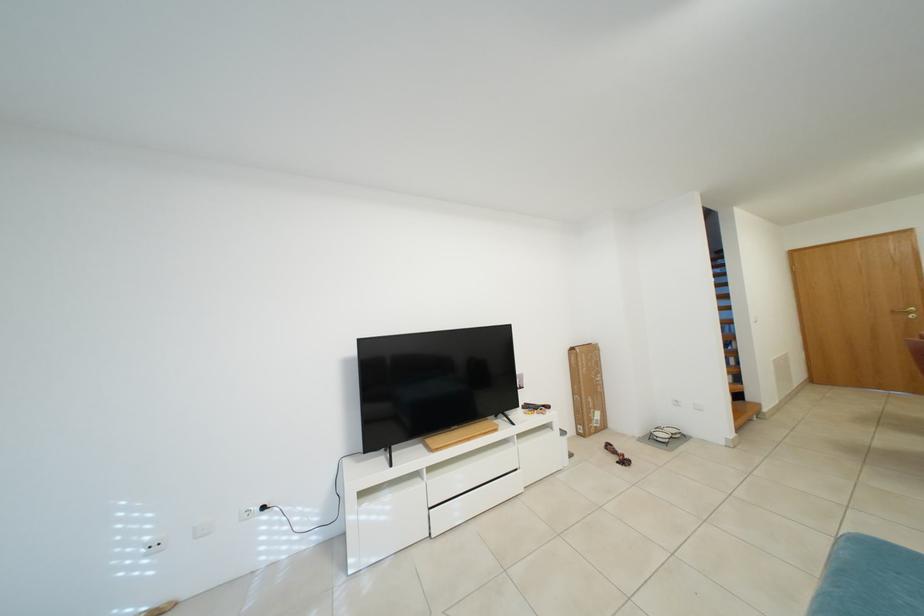
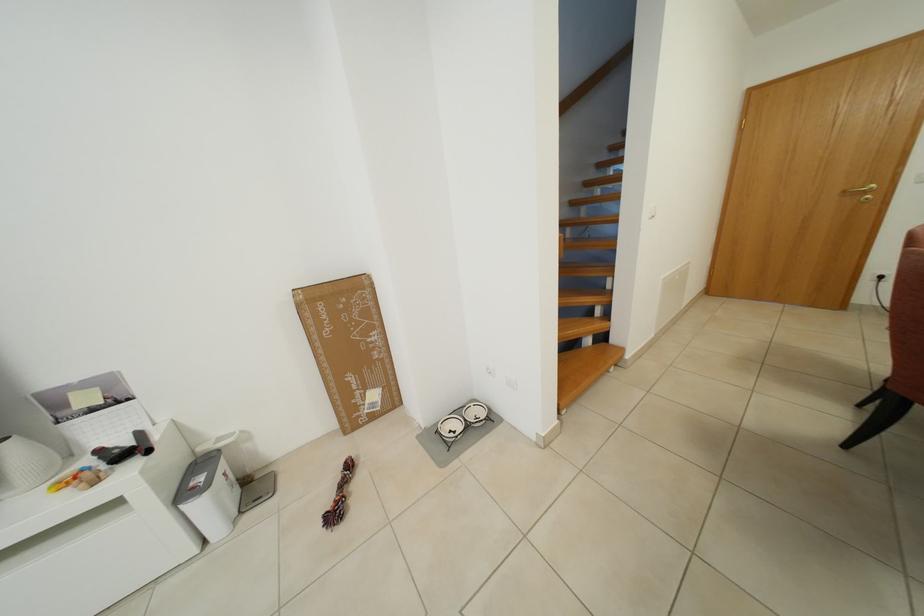
Locate, in the second image, the point that corresponds to (605,419) in the first image.

(382, 400)